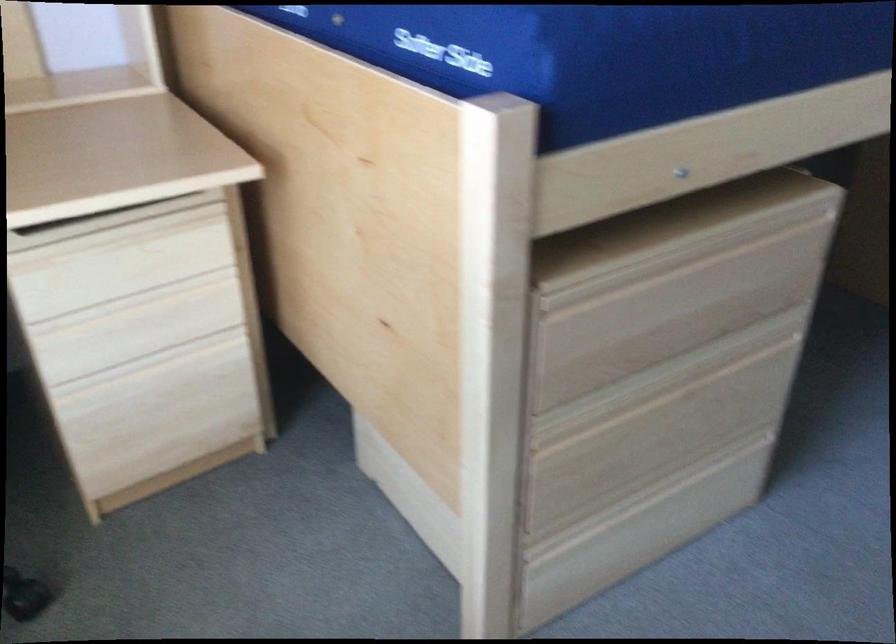
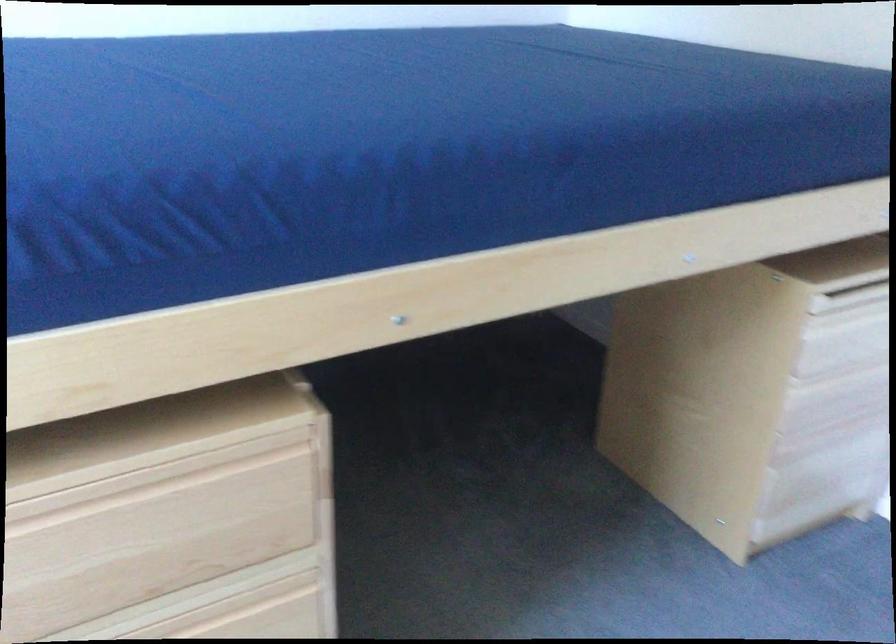
Question: In a continuous first-person perspective shot, in which direction is the camera moving?

Choices:
 (A) Left
 (B) Right
 (C) Forward
 (D) Backward

Answer: (B)